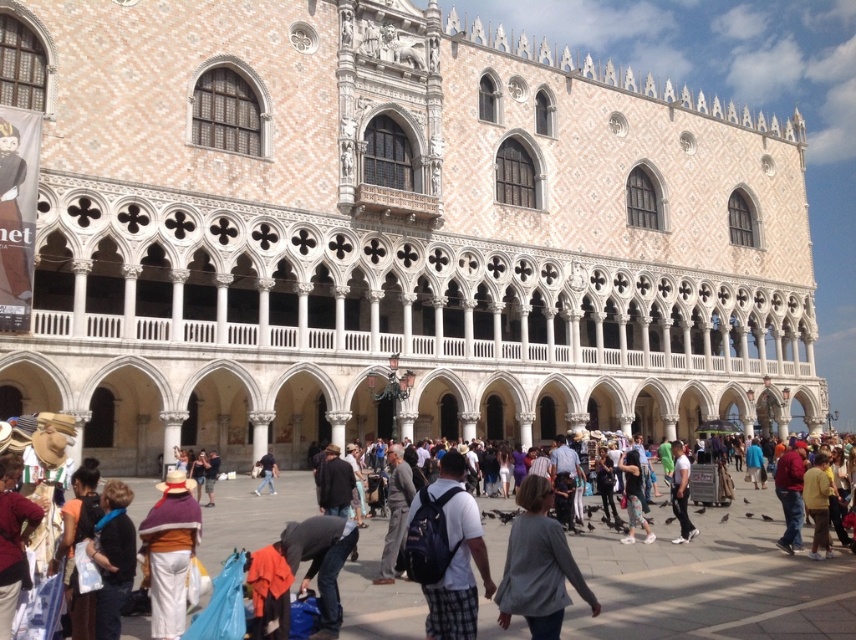
Between dark gray sweater at lower left and denim jacket at center, which one appears on the left side from the viewer's perspective?

denim jacket at center is more to the left.

Which is below, dark gray sweater at lower left or denim jacket at center?

denim jacket at center is lower down.

The height and width of the screenshot is (640, 856). In order to click on dark gray sweater at lower left in this screenshot , I will do `click(111, 557)`.

Can you confirm if white stone building at center is wider than gray cotton sweater at center?

Indeed, white stone building at center has a greater width compared to gray cotton sweater at center.

Is white stone building at center to the right of gray cotton sweater at center from the viewer's perspective?

Yes, white stone building at center is to the right of gray cotton sweater at center.

Does point (797, 243) come in front of point (530, 513)?

No.

Find the location of a particular element. white stone building at center is located at coordinates (390, 234).

Who is more distant from viewer, (544, 477) or (265, 468)?

Positioned behind is point (265, 468).

I want to click on gray cotton sweater at center, so click(538, 564).

Where is `gray cotton sweater at center`? gray cotton sweater at center is located at coordinates (538, 564).